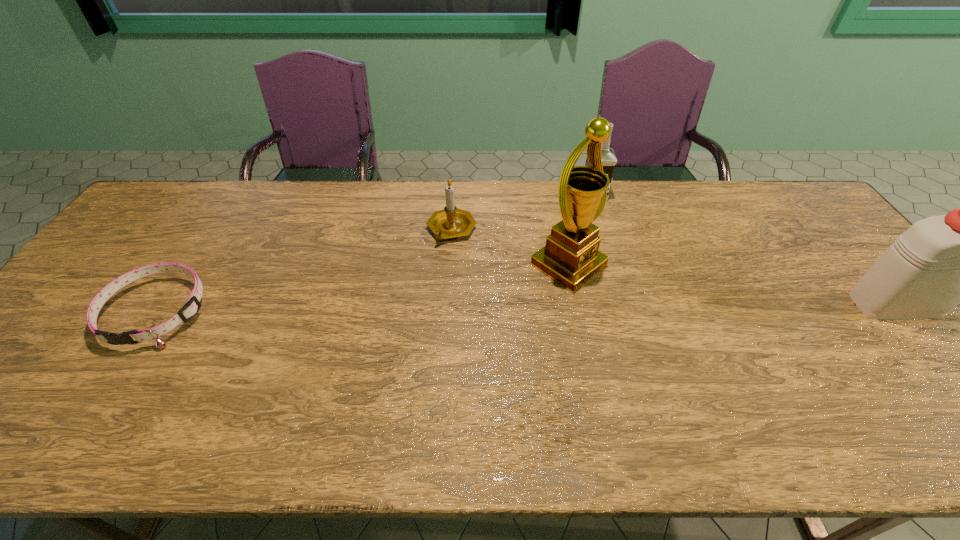
At what (x,y) coordinates should I click in order to perform the action: click on the shortest object. Please return your answer as a coordinate pair (x, y). The width and height of the screenshot is (960, 540). Looking at the image, I should click on (189, 310).

At what (x,y) coordinates should I click in order to perform the action: click on dog collar. Please return your answer as a coordinate pair (x, y). Image resolution: width=960 pixels, height=540 pixels. Looking at the image, I should click on 189,310.

At what (x,y) coordinates should I click in order to perform the action: click on the second tallest object. Please return your answer as a coordinate pair (x, y). Image resolution: width=960 pixels, height=540 pixels. Looking at the image, I should click on (940, 261).

At what (x,y) coordinates should I click in order to perform the action: click on detergent. Please return your answer as a coordinate pair (x, y). The image size is (960, 540). Looking at the image, I should click on (940, 261).

Find the location of a particular element. award is located at coordinates (570, 257).

Find the location of a particular element. This screenshot has width=960, height=540. candle holder is located at coordinates (450, 222).

Locate an element on the screen. the fourth object from right to left is located at coordinates (450, 222).

Locate an element on the screen. The height and width of the screenshot is (540, 960). vodka is located at coordinates (609, 160).

Where is `the third shortest object`? This screenshot has height=540, width=960. the third shortest object is located at coordinates (609, 160).

The image size is (960, 540). Find the location of `free space located 0.100m with the buckle on the shortest object`. free space located 0.100m with the buckle on the shortest object is located at coordinates (107, 389).